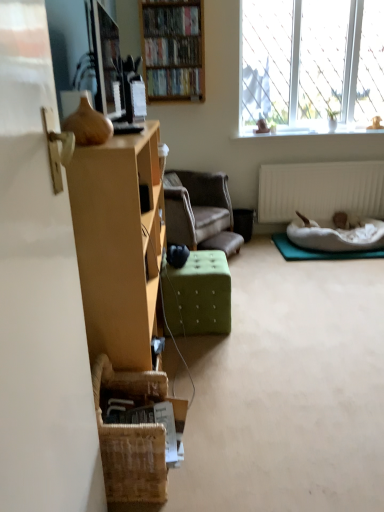
You are a GUI agent. You are given a task and a screenshot of the screen. Output one action in this format:
    pyautogui.click(x=<x>, y=<y>)
    Task: Click on the vacant region above green fabric ottoman at center (from a real-world perspective)
    The image size is (384, 512).
    Given the screenshot: What is the action you would take?
    pyautogui.click(x=202, y=262)